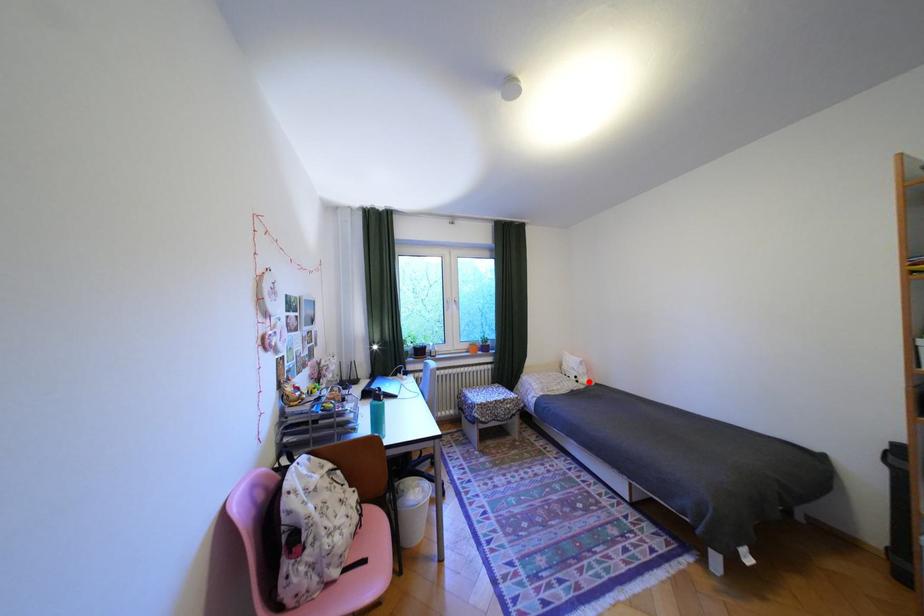
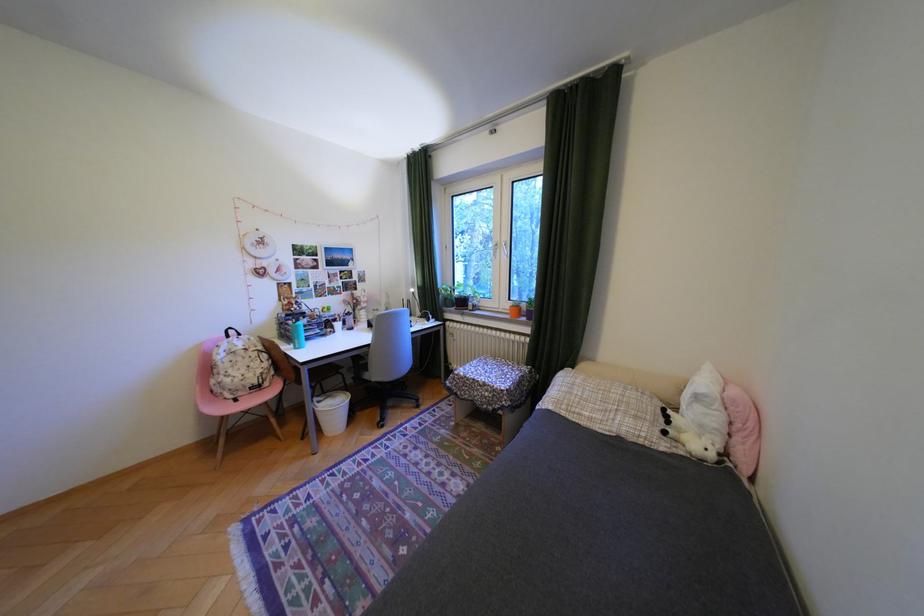
Question: I am providing you with two images of the same scene from different viewpoints. A red point is shown in image1. For the corresponding object point in image2, is it positioned nearer or farther from the camera?

Choices:
 (A) Nearer
 (B) Farther

Answer: (A)